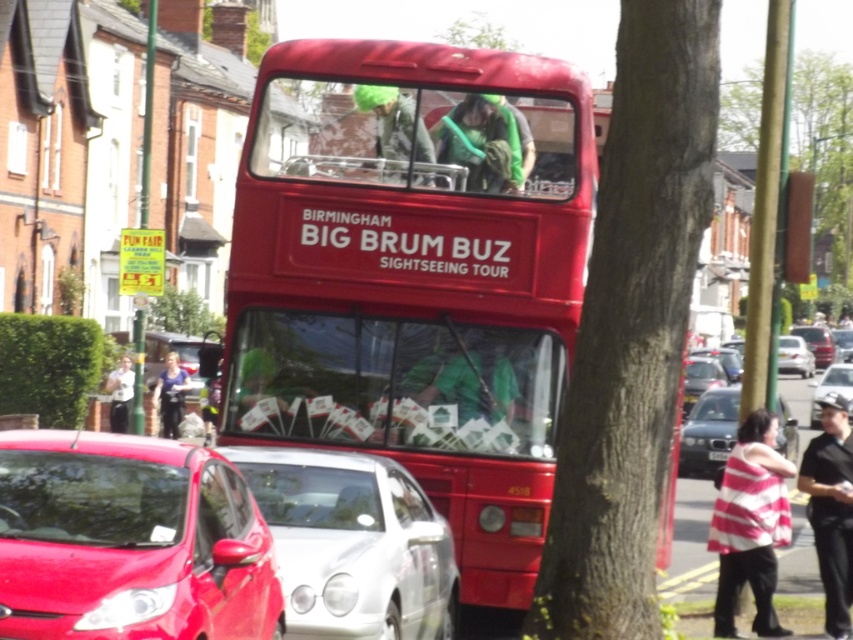
Is shiny red car at lower left positioned in front of black plastic license plate at center?

That is True.

Between point (73, 509) and point (726, 458), which one is positioned in front?

Point (73, 509) is in front.

Where is `shiny red car at lower left`? This screenshot has height=640, width=853. shiny red car at lower left is located at coordinates (129, 541).

Is the position of shiny red bus at center more distant than that of shiny silver car at center?

That is True.

Is shiny red bus at center to the right of shiny silver car at center from the viewer's perspective?

No, shiny red bus at center is not to the right of shiny silver car at center.

The image size is (853, 640). I want to click on shiny red bus at center, so click(415, 275).

Locate an element on the screen. shiny red bus at center is located at coordinates (415, 275).

Does shiny red car at lower left appear over silver metallic sedan at right?

Actually, shiny red car at lower left is below silver metallic sedan at right.

Does shiny red car at lower left come in front of silver metallic sedan at right?

Yes, shiny red car at lower left is in front of silver metallic sedan at right.

Which is in front, point (125, 465) or point (799, 356)?

Point (125, 465)

Locate an element on the screen. shiny red car at lower left is located at coordinates (129, 541).